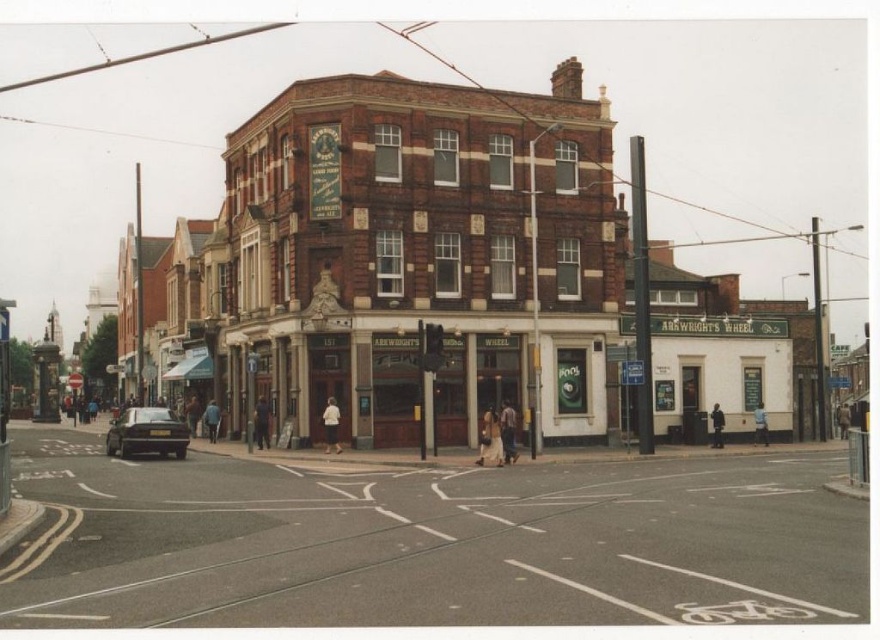
You are standing on the street in front of the corner building and see both the light brown fabric dress at center and the blue fabric jacket at center. Which item is farther away from you?

The light brown fabric dress at center is 69.79 feet away from the blue fabric jacket at center, so the light brown fabric dress at center is farther away from you than the blue fabric jacket at center.

You are standing on the street in front of Arkwrights Wheel. You see a light brown fabric dress at center and a light brown leather jacket at center. If you want to pick up both items, which one should you move towards first?

The distance between the light brown fabric dress at center and the light brown leather jacket at center is 3.29 meters. Since they are both at the center, you can choose either one to move towards first as their positions are central but separated by that distance.